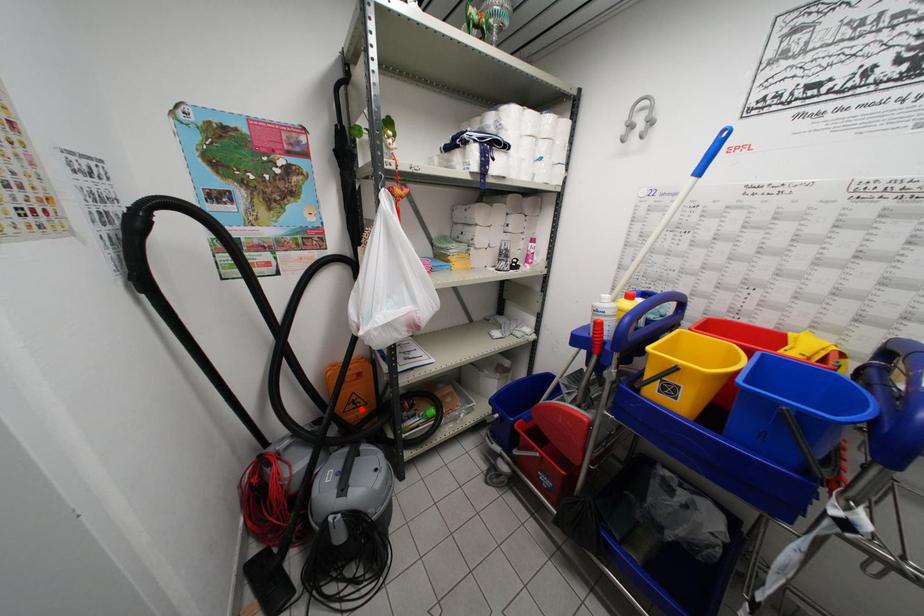
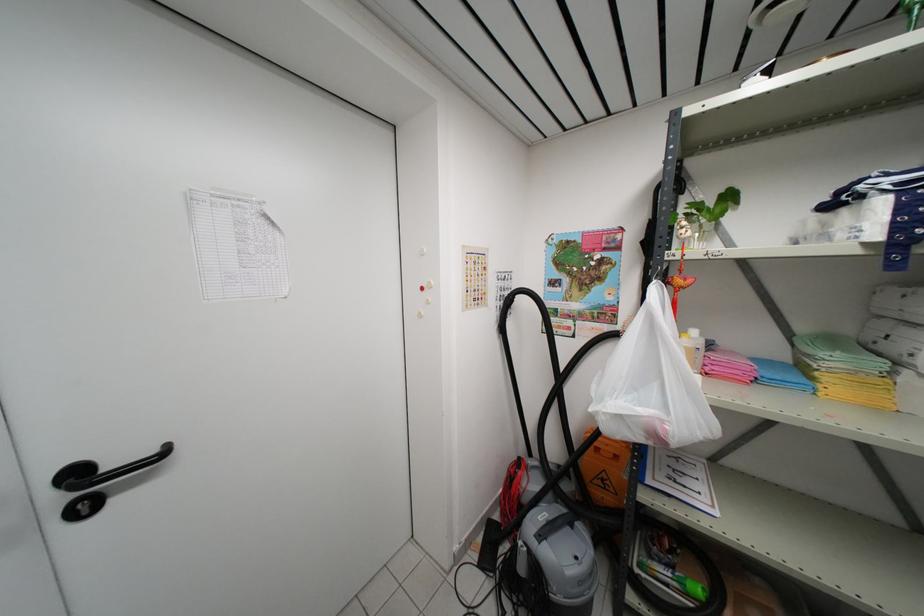
Question: I am providing you with two images of the same scene from different viewpoints. A red point is marked on the first image. Can you still see the location of the red point in image 2?

Choices:
 (A) Yes
 (B) No

Answer: (A)